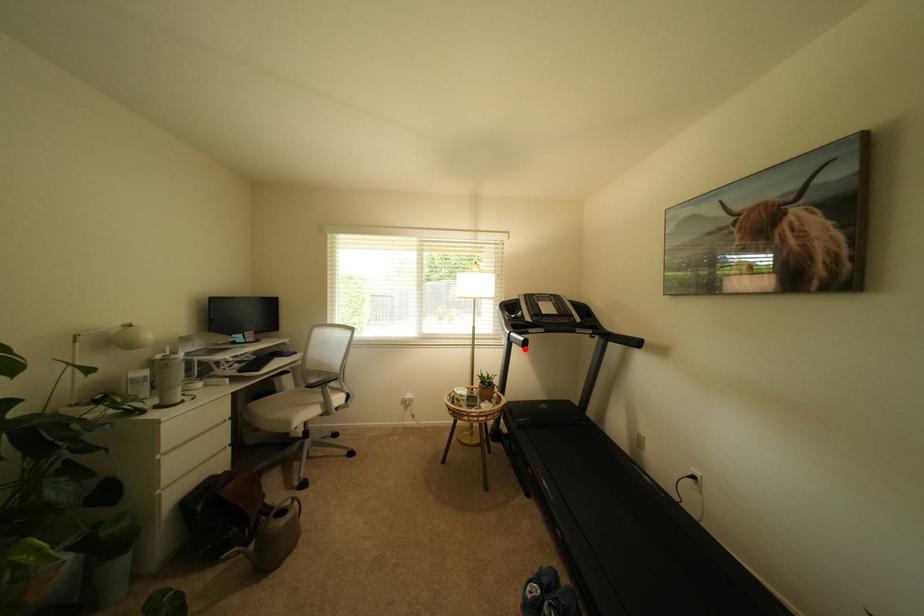
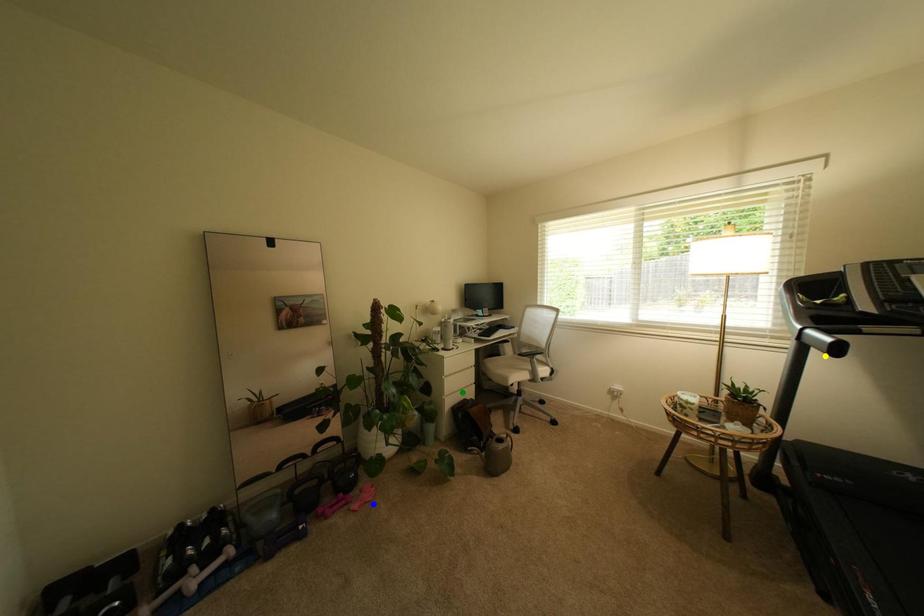
Question: I am providing you with two images of the same scene from different viewpoints. A red point is marked on the first image. You are given multiple points on the second image. Which point in image 2 is actually the same real-world point as the red point in image 1?

Choices:
 (A) green point
 (B) yellow point
 (C) blue point

Answer: (B)